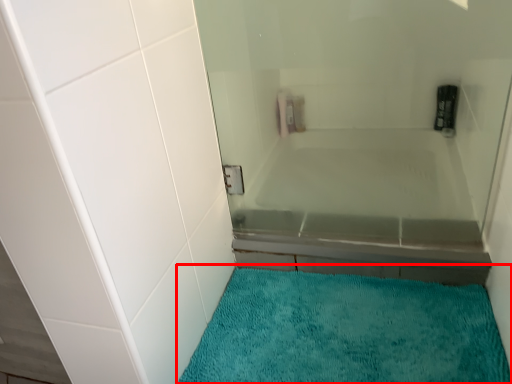
Question: From the image's perspective, what is the correct spatial positioning of bath mat (annotated by the red box) in reference to bath?

Choices:
 (A) below
 (B) above

Answer: (A)